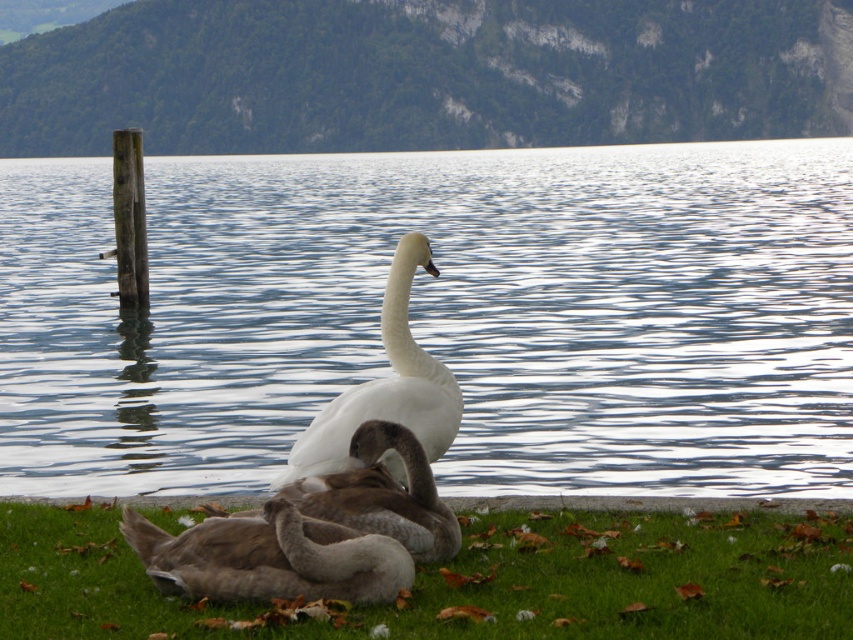
Question: Which of the following is the farthest from the observer?

Choices:
 (A) [x=347, y=515]
 (B) [x=401, y=320]

Answer: (B)

Question: Can you confirm if brown soft grass at lower center is wider than white glossy swan at center?

Choices:
 (A) yes
 (B) no

Answer: (A)

Question: Which of these objects is positioned farthest from the transparent water at center?

Choices:
 (A) brown soft grass at lower center
 (B) brown fuzzy duck at lower center

Answer: (A)

Question: Does transparent water at center appear on the left side of brown fuzzy duck at lower center?

Choices:
 (A) no
 (B) yes

Answer: (B)

Question: Is brown soft grass at lower center closer to camera compared to white glossy swan at center?

Choices:
 (A) no
 (B) yes

Answer: (B)

Question: Which object appears closest to the camera in this image?

Choices:
 (A) brown soft grass at lower center
 (B) transparent water at center
 (C) white glossy swan at center

Answer: (A)